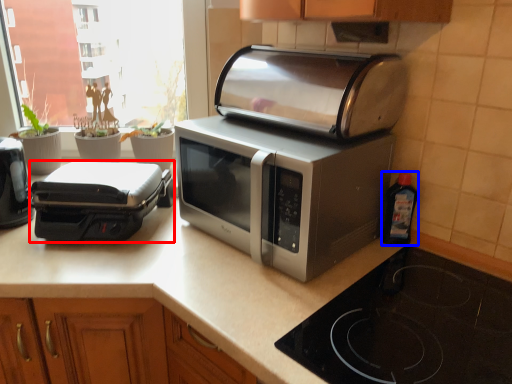
Question: Which point is further to the camera, toaster (highlighted by a red box) or bottle (highlighted by a blue box)?

Choices:
 (A) toaster
 (B) bottle

Answer: (A)